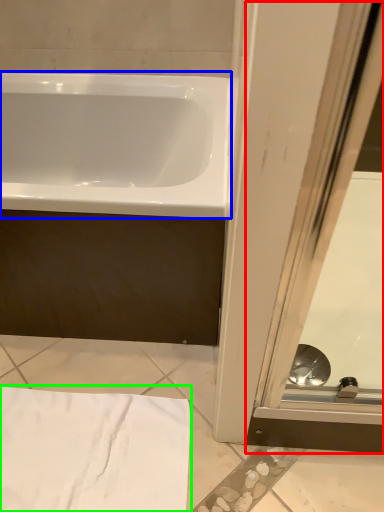
Question: Considering the real-world distances, which object is closest to screen door (highlighted by a red box)? bathtub (highlighted by a blue box) or bath towel (highlighted by a green box).

Choices:
 (A) bathtub
 (B) bath towel

Answer: (B)